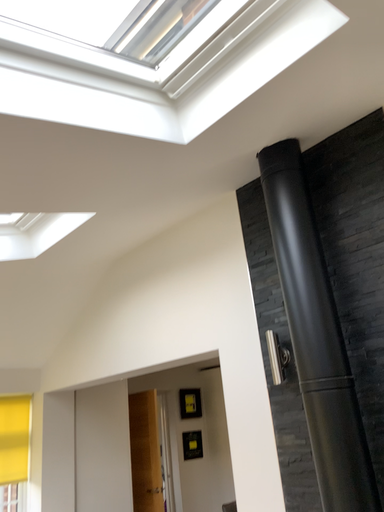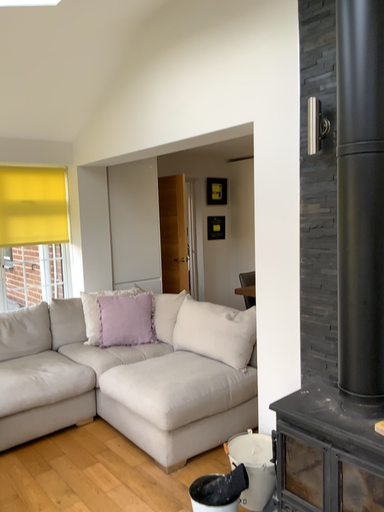
Question: Which way did the camera rotate in the video?

Choices:
 (A) rotated downward
 (B) rotated upward

Answer: (A)